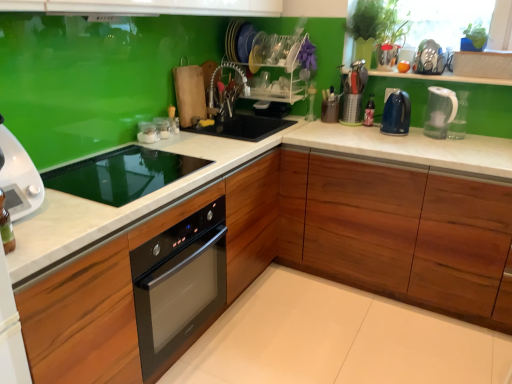
The width and height of the screenshot is (512, 384). What are the coordinates of `free space in front of transparent plastic kettle at right, the 2th kitchen appliance positioned from the left` in the screenshot? It's located at (463, 147).